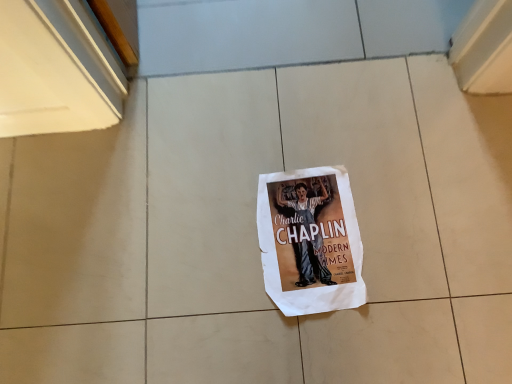
In order to click on vacant region in front of white paper poster at center in this screenshot , I will do `click(332, 327)`.